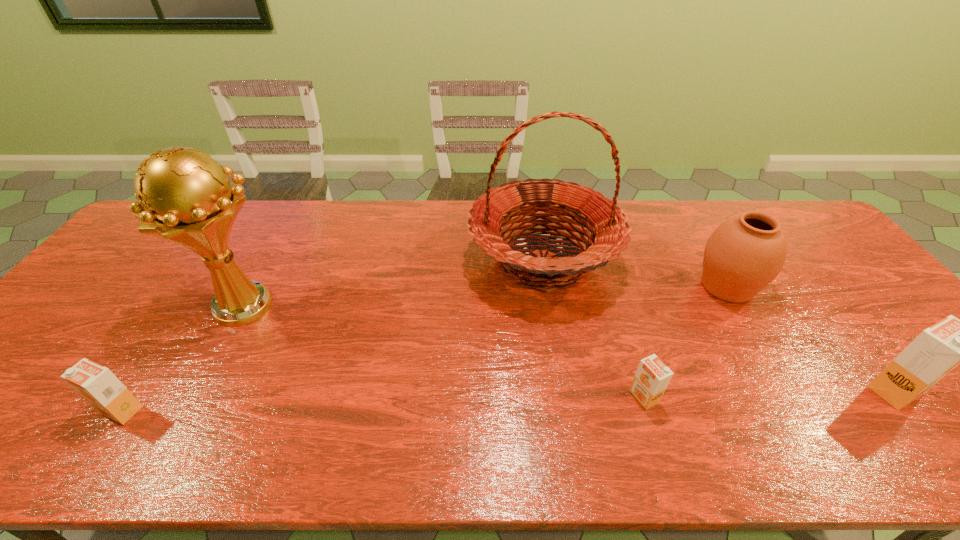
Locate an element on the screen. Image resolution: width=960 pixels, height=540 pixels. free space between the basket and the rightmost object is located at coordinates (719, 325).

What are the coordinates of `free space between the fifth object from left to right and the second shortest orange juice` in the screenshot? It's located at (424, 348).

Locate which object is the fourth closest to the trophy_cup. Please provide its 2D coordinates. Your answer should be formatted as a tuple, i.e. [(x, y)], where the tuple contains the x and y coordinates of a point satisfying the conditions above.

[(745, 253)]

Find the location of a particular element. The image size is (960, 540). object that is the fifth closest to the fifth tallest object is located at coordinates (937, 350).

Locate an element on the screen. Image resolution: width=960 pixels, height=540 pixels. orange juice that is the closest to the leftmost orange juice is located at coordinates (652, 377).

Identify which orange juice is the third nearest to the trophy_cup. Please provide its 2D coordinates. Your answer should be formatted as a tuple, i.e. [(x, y)], where the tuple contains the x and y coordinates of a point satisfying the conditions above.

[(937, 350)]

This screenshot has height=540, width=960. What are the coordinates of `free space in the image that satisfies the following two spatial constraints: 1. on the back side of the leftmost orange juice; 2. on the right side of the basket` in the screenshot? It's located at (221, 260).

Where is `vacant space that satisfies the following two spatial constraints: 1. on the front side of the basket; 2. on the right side of the fifth object from left to right`? vacant space that satisfies the following two spatial constraints: 1. on the front side of the basket; 2. on the right side of the fifth object from left to right is located at coordinates (547, 286).

The image size is (960, 540). Find the location of `vacant space that satisfies the following two spatial constraints: 1. on the front side of the basket; 2. at the front of the trophy_cup where the globe is prominent`. vacant space that satisfies the following two spatial constraints: 1. on the front side of the basket; 2. at the front of the trophy_cup where the globe is prominent is located at coordinates (x=550, y=306).

Find the location of `free region that satisfies the following two spatial constraints: 1. on the front side of the tallest orange juice; 2. on the left side of the urn`. free region that satisfies the following two spatial constraints: 1. on the front side of the tallest orange juice; 2. on the left side of the urn is located at coordinates (788, 390).